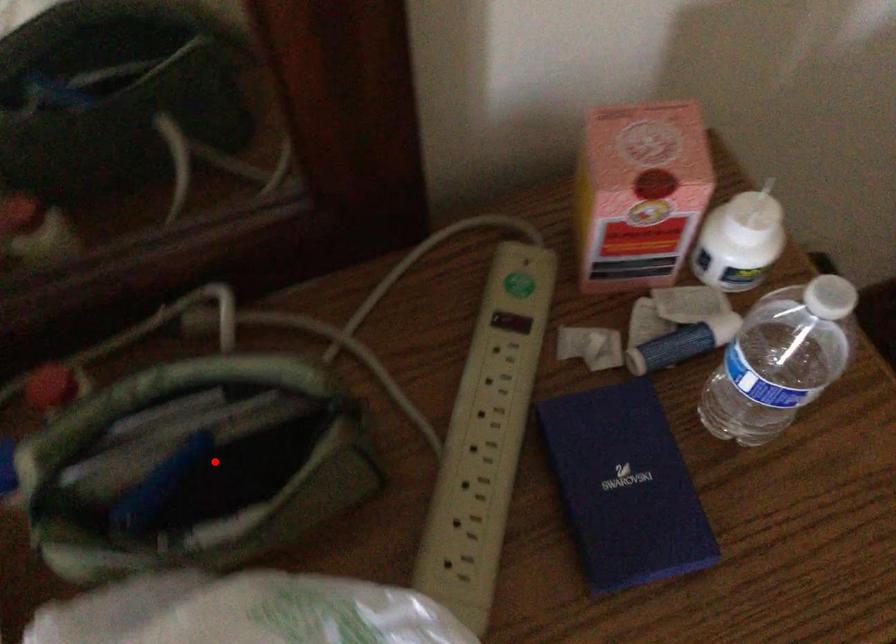
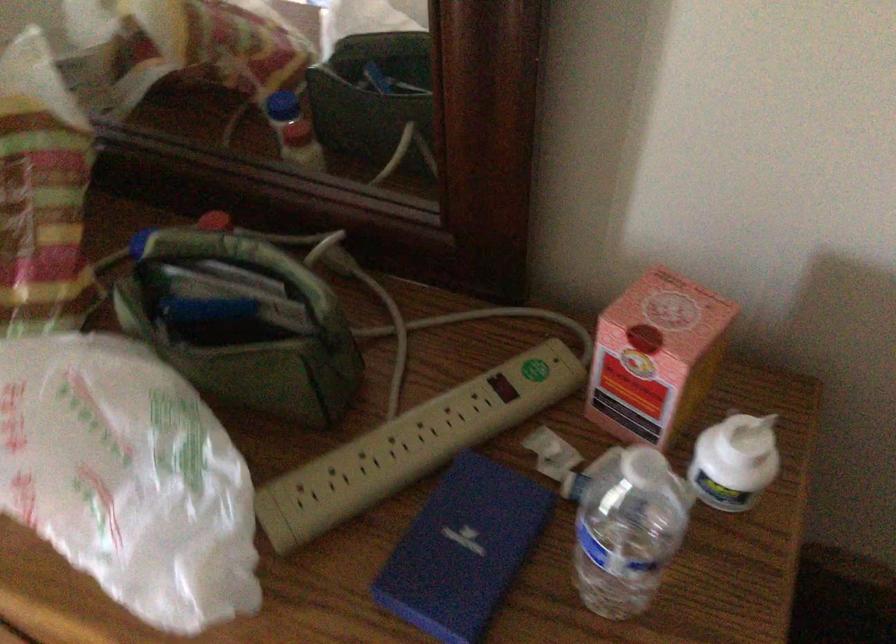
Question: I am providing you with two images of the same scene from different viewpoints. In image1, a red point is highlighted. Considering the same 3D point in image2, which of the following is correct?

Choices:
 (A) It is closer
 (B) It is farther

Answer: (B)